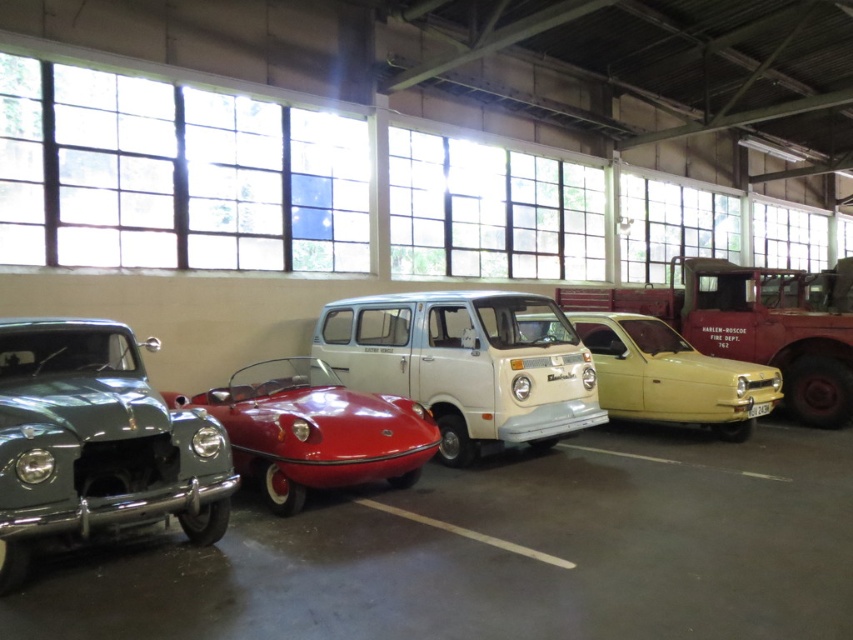
Question: Which object is closer to the camera taking this photo?

Choices:
 (A) shiny red car at center
 (B) yellow matte car at center

Answer: (A)

Question: Can you confirm if white matte van at center is positioned above yellow matte car at center?

Choices:
 (A) yes
 (B) no

Answer: (A)

Question: Does red matte fire truck at right come in front of yellow matte car at center?

Choices:
 (A) yes
 (B) no

Answer: (B)

Question: Among these points, which one is nearest to the camera?

Choices:
 (A) (795, 332)
 (B) (438, 417)
 (C) (338, 388)
 (D) (775, 400)

Answer: (C)

Question: Among these objects, which one is nearest to the camera?

Choices:
 (A) white matte van at center
 (B) yellow matte car at center
 (C) shiny red car at center

Answer: (C)

Question: Considering the relative positions of shiny green car at left and white matte van at center in the image provided, where is shiny green car at left located with respect to white matte van at center?

Choices:
 (A) below
 (B) above

Answer: (A)